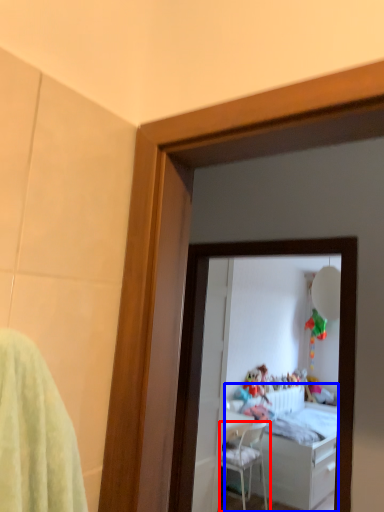
Question: Which point is further to the camera, chair (highlighted by a red box) or bed (highlighted by a blue box)?

Choices:
 (A) chair
 (B) bed

Answer: (B)